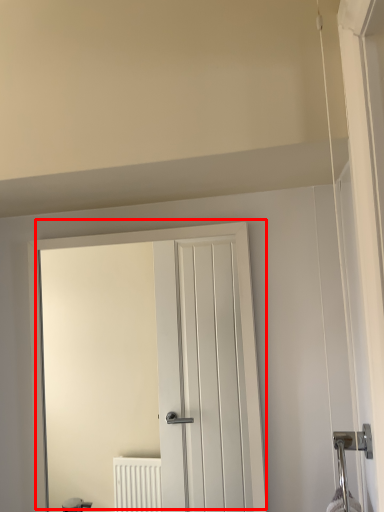
Question: From the image's perspective, what is the correct spatial positioning of door (annotated by the red box) in reference to door handle?

Choices:
 (A) below
 (B) above

Answer: (B)